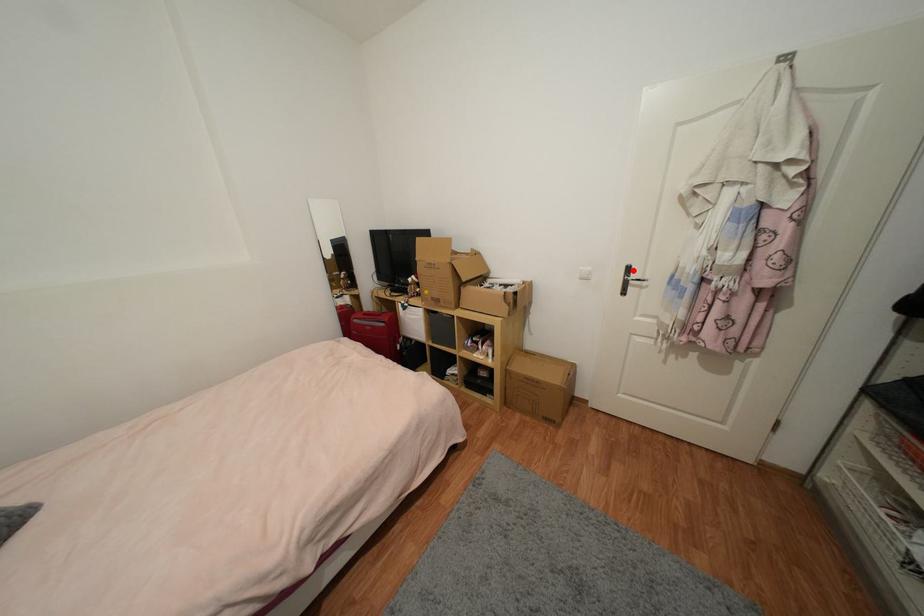
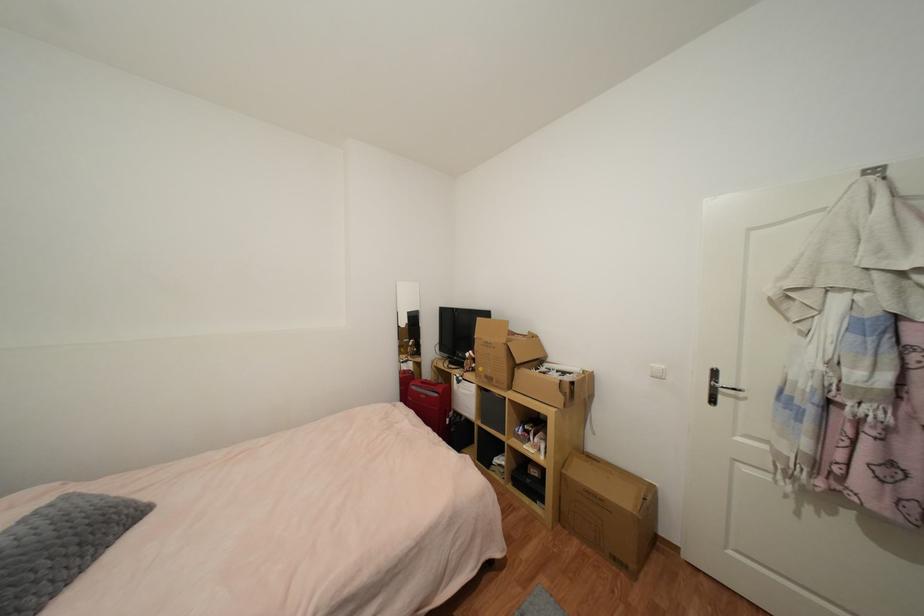
Find the pixel in the second image that matches the highlighted location in the first image.

(720, 374)